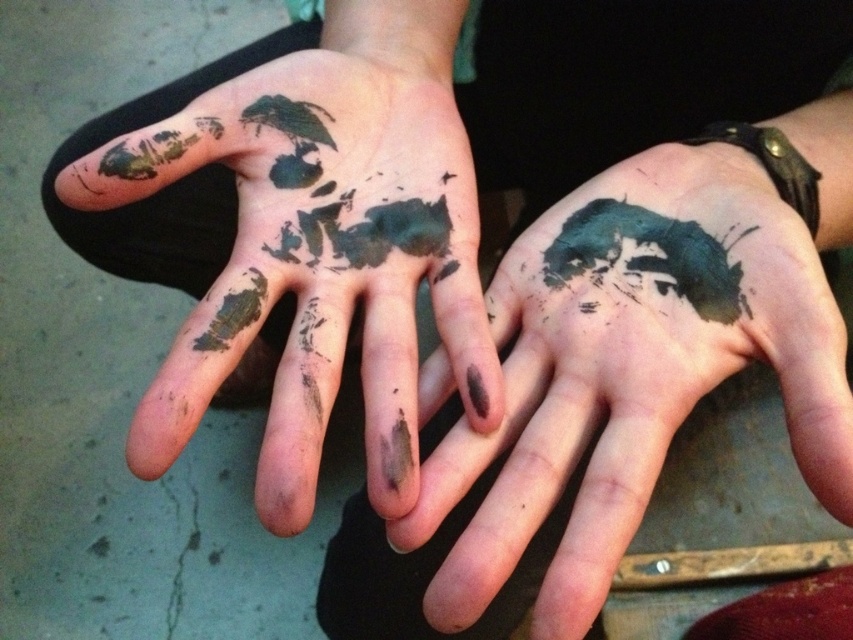
Question: Which point appears closest to the camera in this image?

Choices:
 (A) (592, 260)
 (B) (219, 301)

Answer: (B)

Question: Is dark green paint at center further to the viewer compared to green matte paint splatter at center?

Choices:
 (A) no
 (B) yes

Answer: (A)

Question: From the image, what is the correct spatial relationship of dark green paint at center in relation to watercolor ink cat at center?

Choices:
 (A) below
 (B) above

Answer: (A)

Question: Among these points, which one is farthest from the camera?

Choices:
 (A) (251, 312)
 (B) (601, 269)
 (C) (824, 202)

Answer: (C)

Question: Observing the image, what is the correct spatial positioning of dark green textured mud at center in reference to green matte paint splatter at center?

Choices:
 (A) below
 (B) above

Answer: (B)

Question: Which object appears farthest from the camera in this image?

Choices:
 (A) watercolor ink cat at center
 (B) green matte paint splatter at center

Answer: (A)